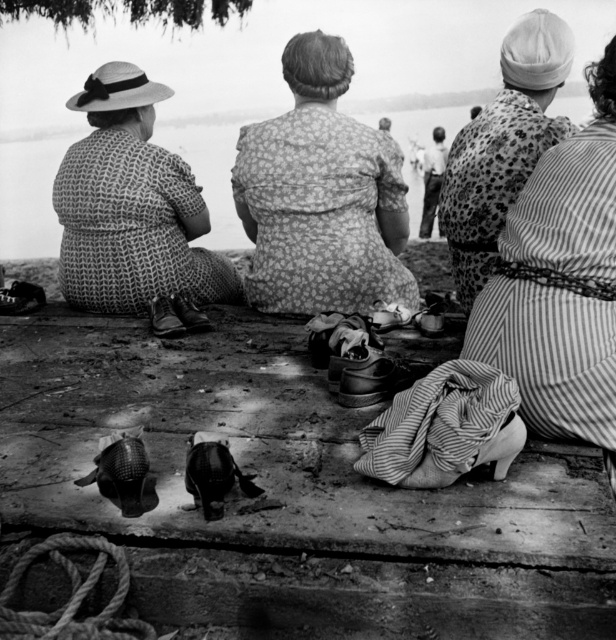
Question: Which of the following is the closest to the observer?

Choices:
 (A) (431, 204)
 (B) (492, 166)
 (C) (352, 129)
 (D) (229, 221)

Answer: (B)

Question: Does woven fabric hat at left have a larger size compared to smooth water at center?

Choices:
 (A) no
 (B) yes

Answer: (B)

Question: Can you confirm if smooth water at center is smaller than smooth skin man at center?

Choices:
 (A) yes
 (B) no

Answer: (A)

Question: Can you confirm if printed fabric dress at center is positioned to the right of smooth water at center?

Choices:
 (A) yes
 (B) no

Answer: (B)

Question: Among these objects, which one is farthest from the camera?

Choices:
 (A) woven fabric hat at left
 (B) printed fabric dress at center

Answer: (A)

Question: Which object is the closest to the smooth water at center?

Choices:
 (A) printed fabric dress at center
 (B) smooth skin man at center
 (C) floral fabric dress at center
 (D) woven fabric hat at left

Answer: (B)